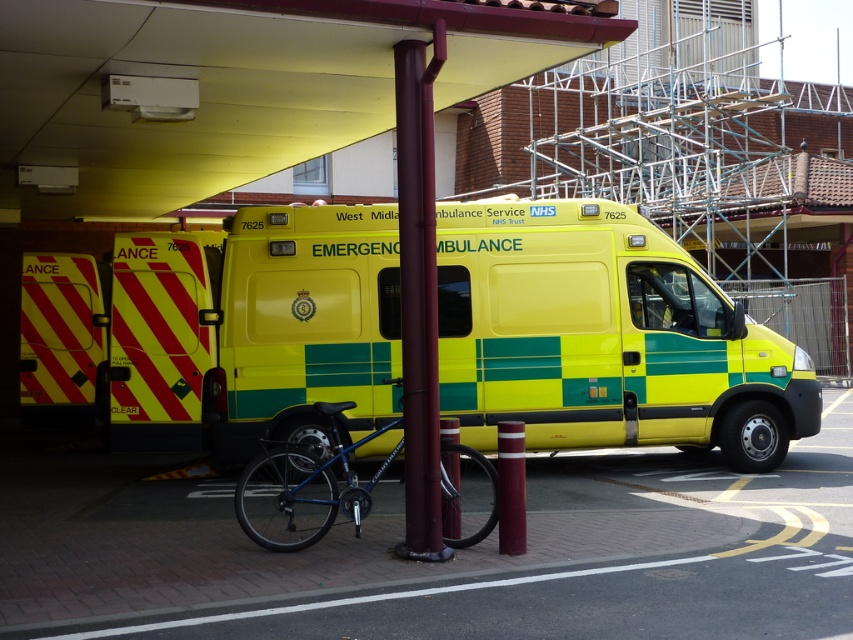
You are a delivery person trying to park your van between the maroon metallic pole at center and the blue metallic bicycle at center. Which object should you back up to first to ensure proper parking alignment?

You should back up to the blue metallic bicycle at center first because the maroon metallic pole at center is closer to the viewer, meaning the bicycle is farther away. Aligning with the farther object first ensures proper parking between them.

You are a delivery driver who needs to park your truck in the parking lot. The parking spot you want to use is marked by point (x=564, y=436). You know your truck is 10 meters long. Can you safely park your truck in that spot without overextending?

The distance between point (x=564, y=436) and the camera is 10.36 meters. Since your truck is only 10 meters long, you have enough space to park safely without overextending.